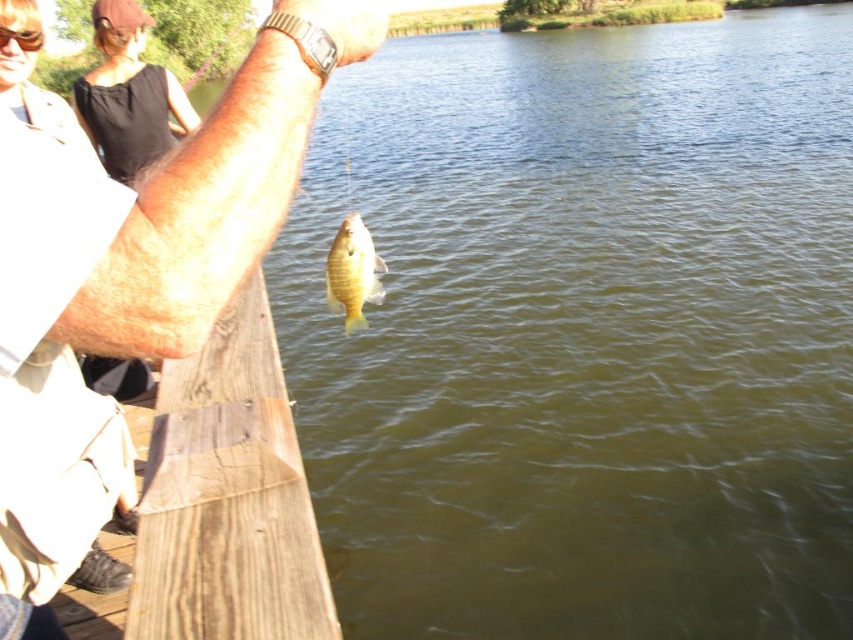
You are standing at the center of the image and want to walk towards the brown wood dock at lower left. Which direction should you move?

The brown wood dock at lower left is located at point (x=218, y=502), so you should move towards the lower left direction to reach it.

You are a photographer trying to capture the yellow shiny fish at center in the scene. Where exactly should you focus your camera to ensure the fish is in the center of your photo?

You should focus your camera at point [352,273] to ensure the yellow shiny fish at center is perfectly centered in your photo.

You are standing at the center of the image and want to locate the brown wood dock at lower left. Which direction should you look to find it?

You should look to the lower left direction to find the brown wood dock at lower left.